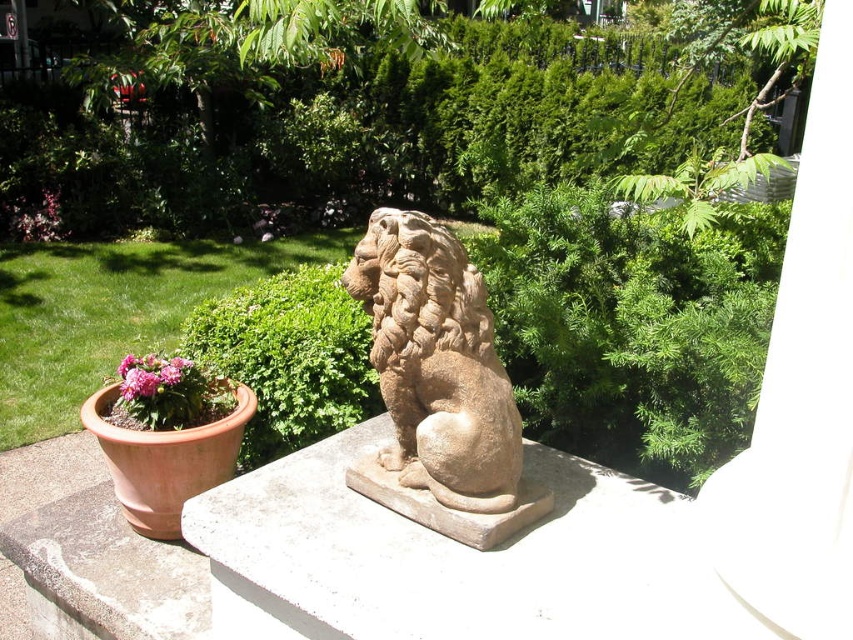
Question: Which point is farther to the camera?

Choices:
 (A) green leafy bush at center
 (B) pink matte flower at lower left
 (C) brown stone lion at center

Answer: (A)

Question: Observing the image, what is the correct spatial positioning of green leafy bush at center in reference to pink matte flower at lower left?

Choices:
 (A) above
 (B) below

Answer: (A)

Question: Which point is farther to the camera?

Choices:
 (A) pink matte flower at lower left
 (B) green leafy bush at center
 (C) brown stone lion at center

Answer: (B)

Question: Considering the relative positions of brown stone lion at center and pink matte flower at lower left in the image provided, where is brown stone lion at center located with respect to pink matte flower at lower left?

Choices:
 (A) below
 (B) above

Answer: (B)

Question: Which object appears closest to the camera in this image?

Choices:
 (A) pink matte flower at lower left
 (B) green leafy bush at center

Answer: (A)

Question: Is brown stone lion at center further to the viewer compared to pink matte flower at lower left?

Choices:
 (A) yes
 (B) no

Answer: (B)